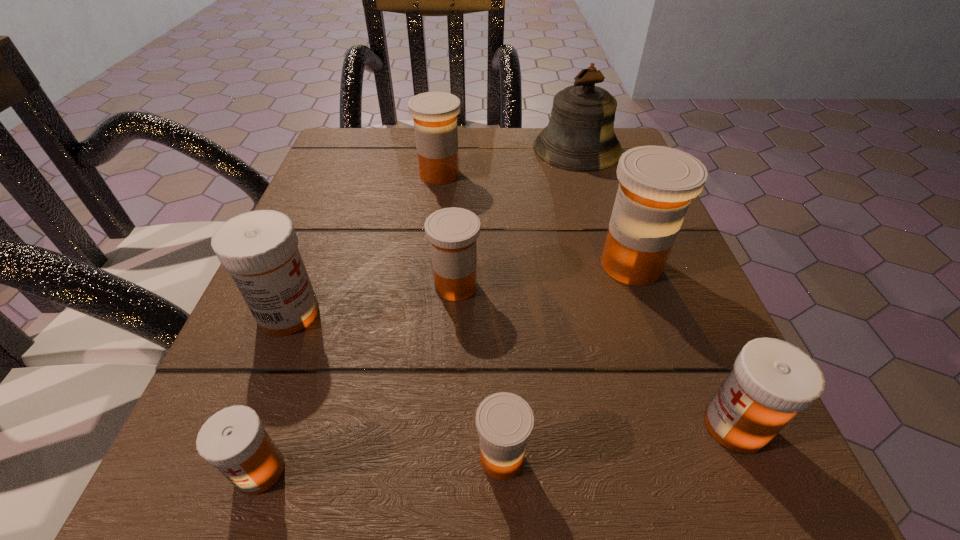
The image size is (960, 540). In order to click on unoccupied position between the rightmost orange medicine and the smallest orange medicine in this screenshot , I will do `click(566, 361)`.

Select which object appears as the sixth closest to the biggest white medicine. Please provide its 2D coordinates. Your answer should be formatted as a tuple, i.e. [(x, y)], where the tuple contains the x and y coordinates of a point satisfying the conditions above.

[(580, 136)]

Identify which object is the fourth closest to the farthest white medicine. Please provide its 2D coordinates. Your answer should be formatted as a tuple, i.e. [(x, y)], where the tuple contains the x and y coordinates of a point satisfying the conditions above.

[(435, 114)]

This screenshot has width=960, height=540. Find the location of `medicine that stands as the third closest to the bell`. medicine that stands as the third closest to the bell is located at coordinates (452, 232).

Select which medicine appears as the closest to the bell. Please provide its 2D coordinates. Your answer should be formatted as a tuple, i.e. [(x, y)], where the tuple contains the x and y coordinates of a point satisfying the conditions above.

[(435, 114)]

Point out which orange medicine is positioned as the third nearest to the biggest orange medicine. Please provide its 2D coordinates. Your answer should be formatted as a tuple, i.e. [(x, y)], where the tuple contains the x and y coordinates of a point satisfying the conditions above.

[(435, 114)]

Choose which orange medicine is the nearest neighbor to the farthest white medicine. Please provide its 2D coordinates. Your answer should be formatted as a tuple, i.e. [(x, y)], where the tuple contains the x and y coordinates of a point satisfying the conditions above.

[(452, 232)]

Where is `white medicine that is the closest to the smallest white medicine`? This screenshot has width=960, height=540. white medicine that is the closest to the smallest white medicine is located at coordinates (259, 248).

In order to click on white medicine that stands as the third closest to the smallest orange medicine in this screenshot , I will do `click(259, 248)`.